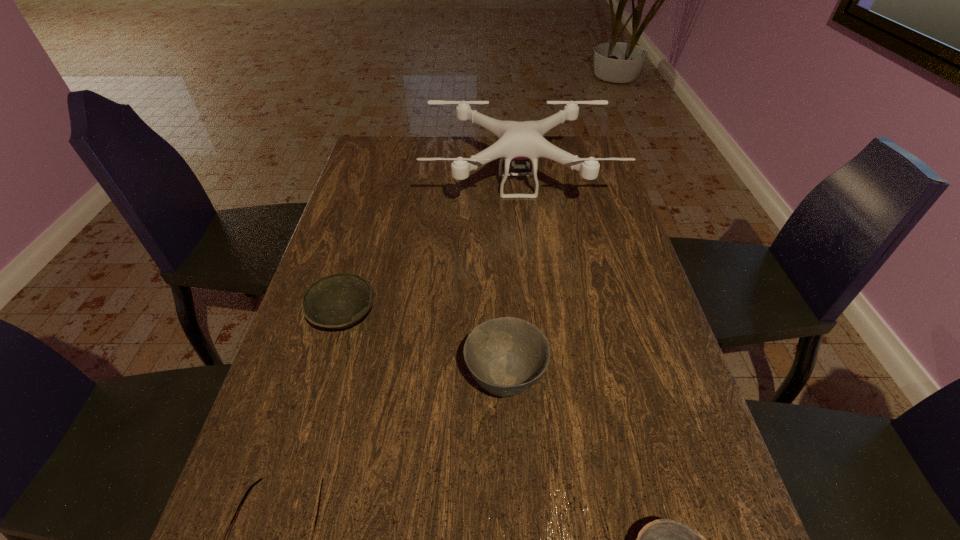
I want to click on bowl that is the third closest to the tallest object, so click(663, 539).

This screenshot has height=540, width=960. I want to click on the second closest bowl to the second bowl from right to left, so click(663, 539).